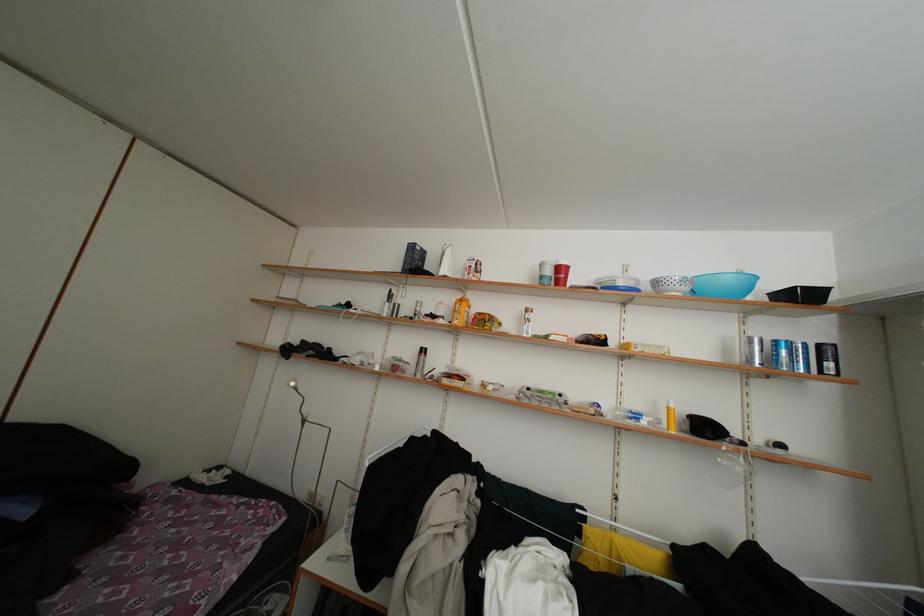
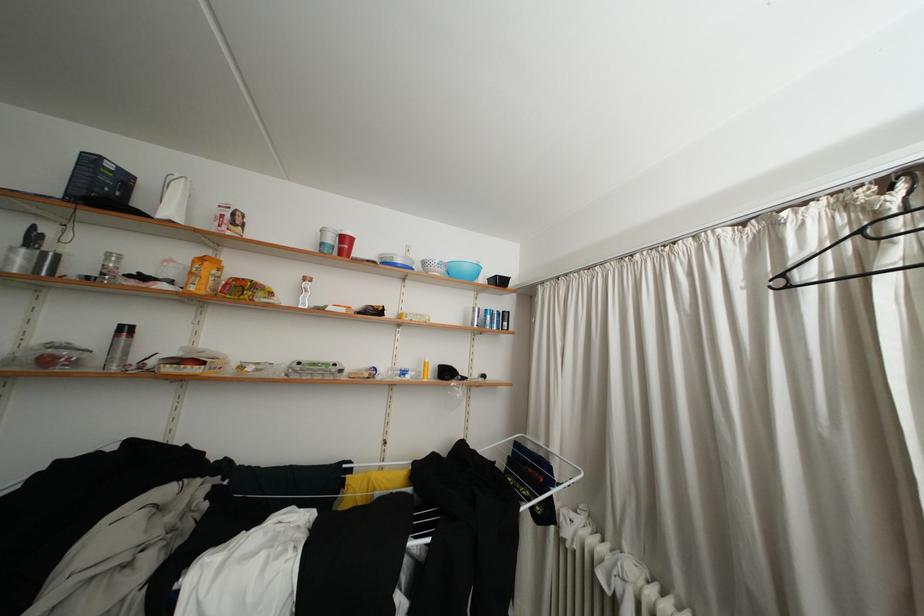
Locate, in the second image, the point that corresponds to [695,294] in the first image.

(451, 276)